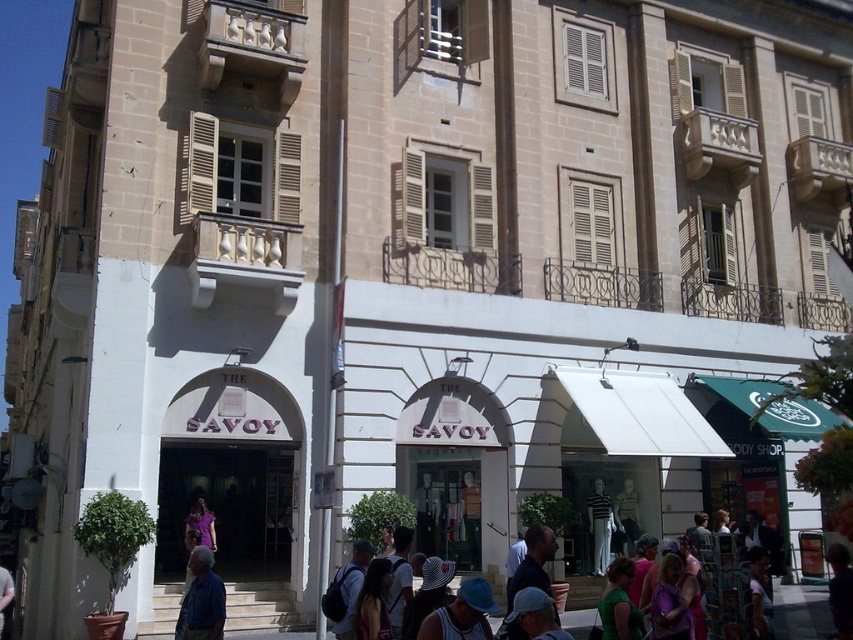
Is matte blue hat at lower center thinner than blue fabric cap at center?

In fact, matte blue hat at lower center might be wider than blue fabric cap at center.

How far apart are matte blue hat at lower center and blue fabric cap at center?

3.89 feet

Locate an element on the screen. matte blue hat at lower center is located at coordinates (461, 614).

Where is `matte blue hat at lower center`? The height and width of the screenshot is (640, 853). matte blue hat at lower center is located at coordinates (461, 614).

Can you confirm if blue fabric shirt at lower left is positioned below blue fabric cap at center?

Yes.

Who is shorter, blue fabric shirt at lower left or blue fabric cap at center?

Standing shorter between the two is blue fabric shirt at lower left.

Identify the location of blue fabric shirt at lower left. (201, 600).

Is point (202, 580) more distant than point (479, 596)?

Yes, it is behind point (479, 596).

Does point (202, 620) come in front of point (442, 637)?

No, it is behind (442, 637).

You are a GUI agent. You are given a task and a screenshot of the screen. Output one action in this format:
    pyautogui.click(x=<x>, y=<y>)
    Task: Click on the blue fabric shirt at lower left
    
    Given the screenshot: What is the action you would take?
    pyautogui.click(x=201, y=600)

I want to click on blue fabric shirt at lower left, so click(201, 600).